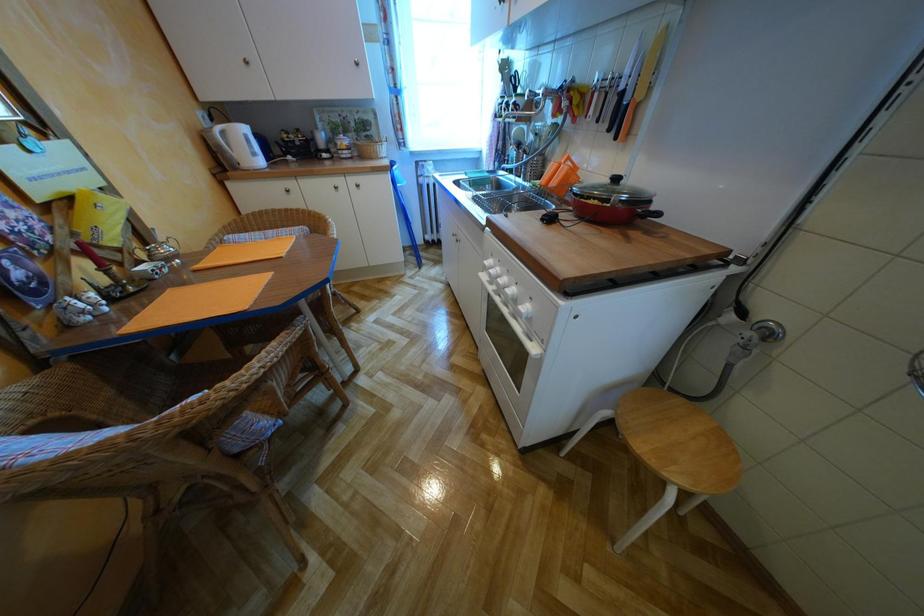
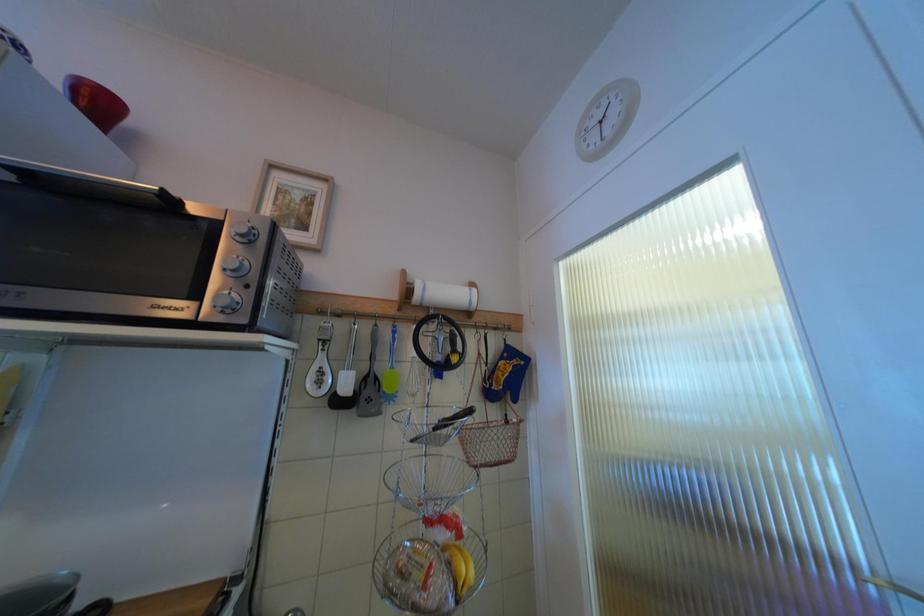
Question: How did the camera likely rotate?

Choices:
 (A) Left
 (B) Right
 (C) Up
 (D) Down

Answer: (B)